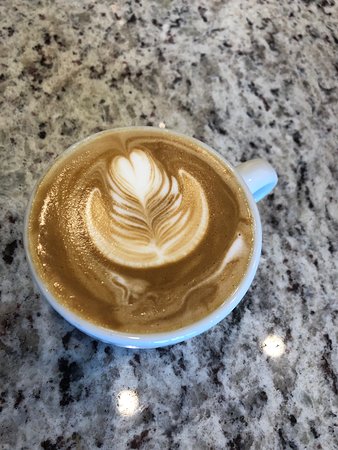
The height and width of the screenshot is (450, 338). In order to click on handle in this screenshot , I will do `click(251, 180)`.